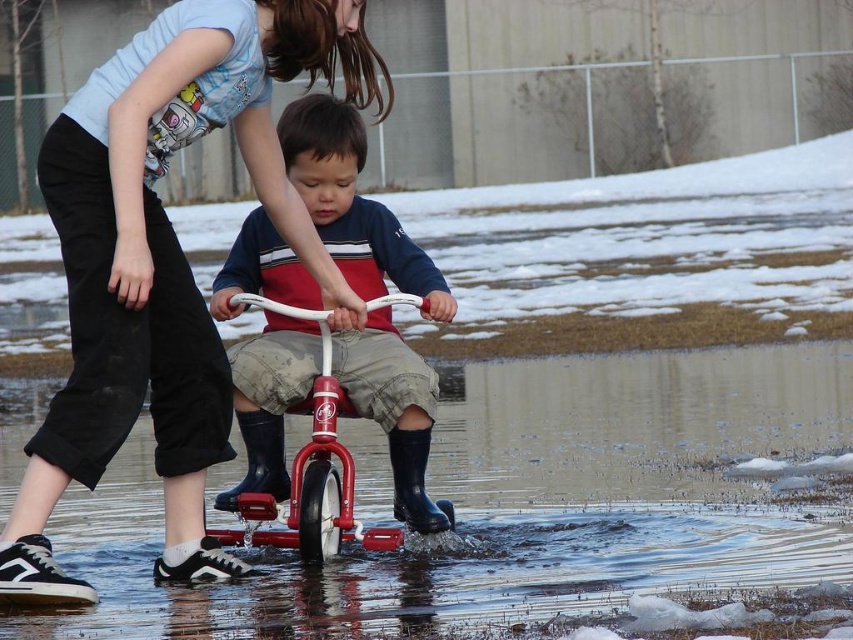
Question: Which point appears farthest from the camera in this image?

Choices:
 (A) (781, 458)
 (B) (300, 449)
 (C) (270, 202)

Answer: (A)

Question: In this image, where is clear water at lower center located relative to metallic red bicycle at center?

Choices:
 (A) right
 (B) left

Answer: (A)

Question: Estimate the real-world distances between objects in this image. Which object is farther from the matte black pants at lower left?

Choices:
 (A) metallic red bicycle at center
 (B) clear water at lower center

Answer: (B)

Question: Is matte black pants at lower left to the right of metallic red bicycle at center from the viewer's perspective?

Choices:
 (A) yes
 (B) no

Answer: (B)

Question: From the image, what is the correct spatial relationship of clear water at lower center in relation to metallic red bicycle at center?

Choices:
 (A) left
 (B) right

Answer: (B)

Question: Based on their relative distances, which object is nearer to the clear water at lower center?

Choices:
 (A) matte black pants at lower left
 (B) metallic red bicycle at center

Answer: (B)